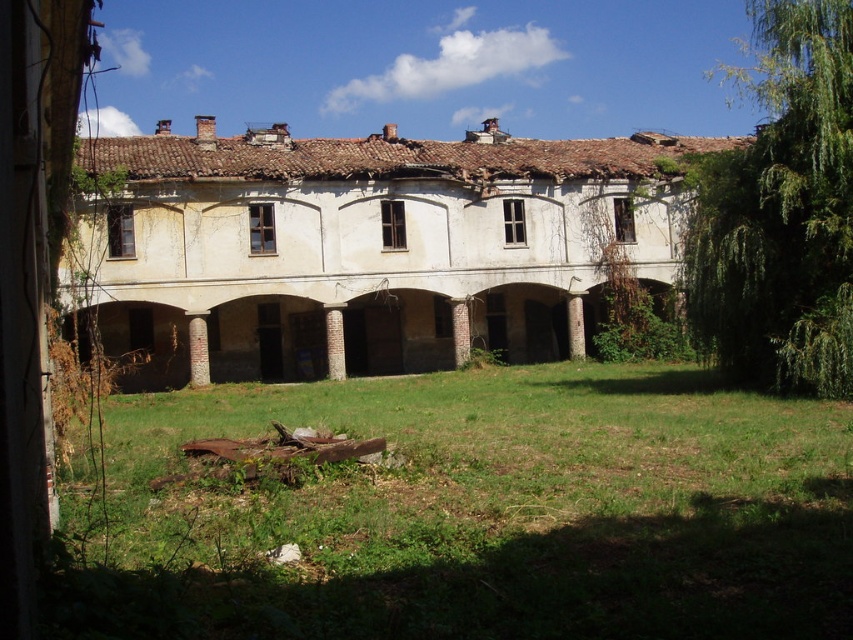
Is point (206, 321) less distant than point (581, 324)?

Yes, point (206, 321) is in front of point (581, 324).

Which is below, white brick column at center or brown stone pillar at center-right?

white brick column at center is below.

Image resolution: width=853 pixels, height=640 pixels. What do you see at coordinates (198, 349) in the screenshot? I see `white brick column at center` at bounding box center [198, 349].

Where is `white brick column at center`? Image resolution: width=853 pixels, height=640 pixels. white brick column at center is located at coordinates (198, 349).

In the scene shown: Can you confirm if white brick column at center is taller than brown stone column at center?

Incorrect, white brick column at center's height is not larger of brown stone column at center's.

Between white brick column at center and brown stone column at center, which one appears on the left side from the viewer's perspective?

From the viewer's perspective, white brick column at center appears more on the left side.

This screenshot has height=640, width=853. What do you see at coordinates (198, 349) in the screenshot? I see `white brick column at center` at bounding box center [198, 349].

This screenshot has width=853, height=640. In order to click on white brick column at center in this screenshot , I will do `click(198, 349)`.

Does white brick column at center have a lesser width compared to red brick pillar at center?

Incorrect, white brick column at center's width is not less than red brick pillar at center's.

Does white brick column at center have a lesser height compared to red brick pillar at center?

Indeed, white brick column at center has a lesser height compared to red brick pillar at center.

This screenshot has height=640, width=853. What are the coordinates of `white brick column at center` in the screenshot? It's located at (198, 349).

You are a GUI agent. You are given a task and a screenshot of the screen. Output one action in this format:
    pyautogui.click(x=<x>, y=<y>)
    Task: Click on the white brick column at center
    The image size is (853, 640).
    Given the screenshot: What is the action you would take?
    pyautogui.click(x=198, y=349)